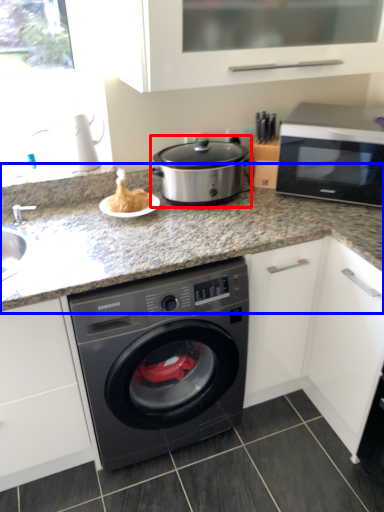
Question: Which object is further to the camera taking this photo, slow cooker (highlighted by a red box) or countertop (highlighted by a blue box)?

Choices:
 (A) slow cooker
 (B) countertop

Answer: (A)